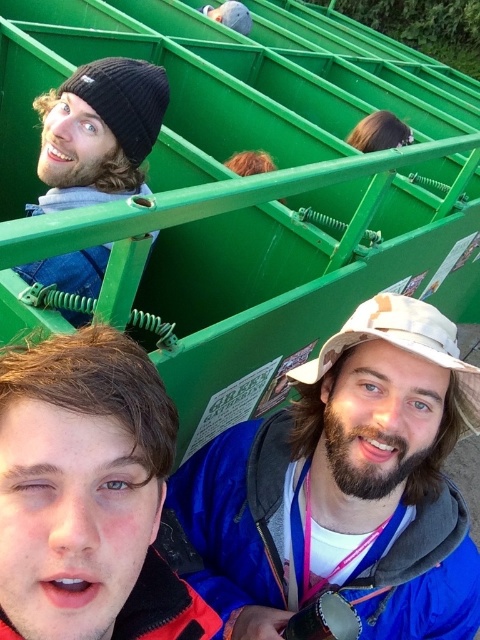
Where is `black knit beanie at upper left`? This screenshot has height=640, width=480. black knit beanie at upper left is located at coordinates (98, 132).

You are a GUI agent. You are given a task and a screenshot of the screen. Output one action in this format:
    pyautogui.click(x=<x>, y=<y>)
    Task: Click on the black knit beanie at upper left
    This screenshot has width=480, height=640.
    Given the screenshot: What is the action you would take?
    pyautogui.click(x=98, y=132)

Consider the image. Is beige fabric hat at center closer to camera compared to black knit beanie at upper left?

Yes.

Looking at this image, can you confirm if beige fabric hat at center is bigger than black knit beanie at upper left?

Yes.

Which is in front, point (414, 426) or point (81, 67)?

Positioned in front is point (414, 426).

Locate an element on the screen. beige fabric hat at center is located at coordinates (340, 488).

Can you confirm if matte blue jacket at lower left is bigger than white fabric baseball hat at center?

No, matte blue jacket at lower left is not bigger than white fabric baseball hat at center.

Who is positioned more to the right, matte blue jacket at lower left or white fabric baseball hat at center?

white fabric baseball hat at center

What do you see at coordinates (87, 493) in the screenshot?
I see `matte blue jacket at lower left` at bounding box center [87, 493].

Where is `matte blue jacket at lower left`? matte blue jacket at lower left is located at coordinates (87, 493).